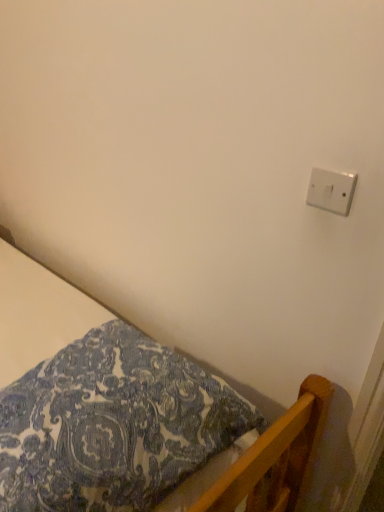
Question: Is patterned fabric bed at lower left positioned in front of white plastic light switch at upper right?

Choices:
 (A) yes
 (B) no

Answer: (A)

Question: Would you say patterned fabric bed at lower left is a long distance from white plastic light switch at upper right?

Choices:
 (A) yes
 (B) no

Answer: (B)

Question: Does patterned fabric bed at lower left have a lesser width compared to white plastic light switch at upper right?

Choices:
 (A) no
 (B) yes

Answer: (A)

Question: Does patterned fabric bed at lower left turn towards white plastic light switch at upper right?

Choices:
 (A) no
 (B) yes

Answer: (A)

Question: Is the depth of patterned fabric bed at lower left greater than that of white plastic light switch at upper right?

Choices:
 (A) no
 (B) yes

Answer: (A)

Question: Does patterned fabric bed at lower left have a lesser height compared to white plastic light switch at upper right?

Choices:
 (A) no
 (B) yes

Answer: (A)

Question: Can you confirm if white plastic light switch at upper right is bigger than patterned fabric bed at lower left?

Choices:
 (A) no
 (B) yes

Answer: (A)

Question: Does white plastic light switch at upper right have a greater height compared to patterned fabric bed at lower left?

Choices:
 (A) yes
 (B) no

Answer: (B)

Question: From a real-world perspective, is white plastic light switch at upper right over patterned fabric bed at lower left?

Choices:
 (A) yes
 (B) no

Answer: (A)

Question: Is white plastic light switch at upper right turned away from patterned fabric bed at lower left?

Choices:
 (A) no
 (B) yes

Answer: (A)

Question: Does white plastic light switch at upper right come behind patterned fabric bed at lower left?

Choices:
 (A) yes
 (B) no

Answer: (A)

Question: Does white plastic light switch at upper right have a smaller size compared to patterned fabric bed at lower left?

Choices:
 (A) yes
 (B) no

Answer: (A)

Question: Does point (286, 438) appear closer or farther from the camera than point (340, 214)?

Choices:
 (A) farther
 (B) closer

Answer: (A)